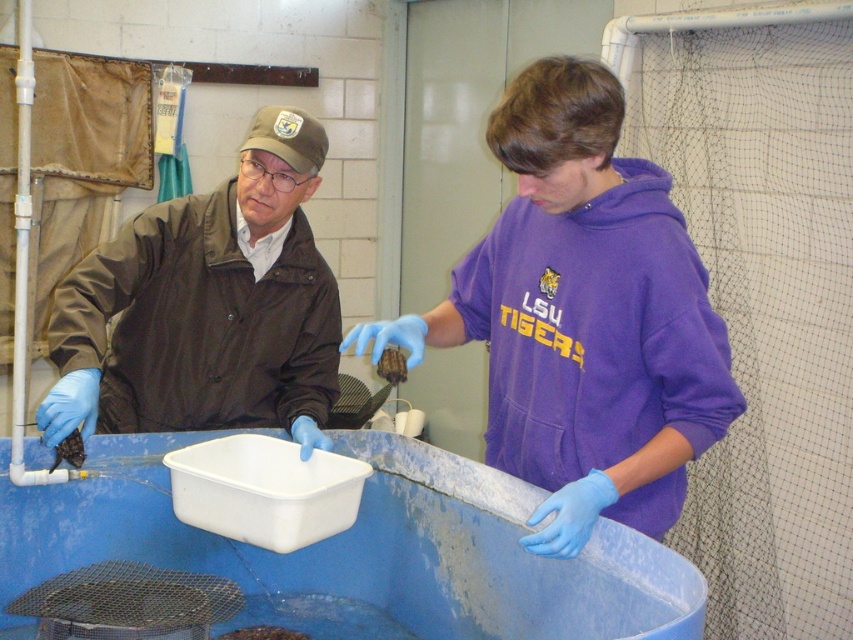
Who is lower down, purple fleece hoodie at center or brown matte jacket at left?

brown matte jacket at left

Can you confirm if purple fleece hoodie at center is taller than brown matte jacket at left?

Yes, purple fleece hoodie at center is taller than brown matte jacket at left.

This screenshot has height=640, width=853. I want to click on purple fleece hoodie at center, so click(583, 316).